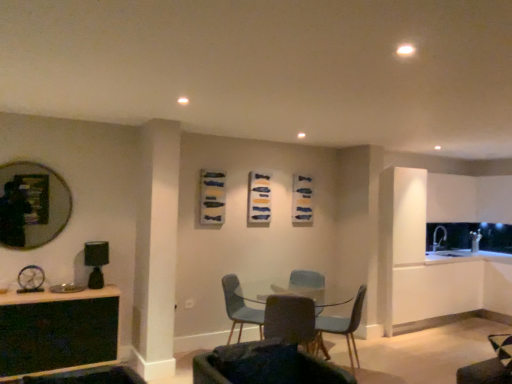
The image size is (512, 384). I want to click on free spot in front of black matte lamp at left, so click(91, 291).